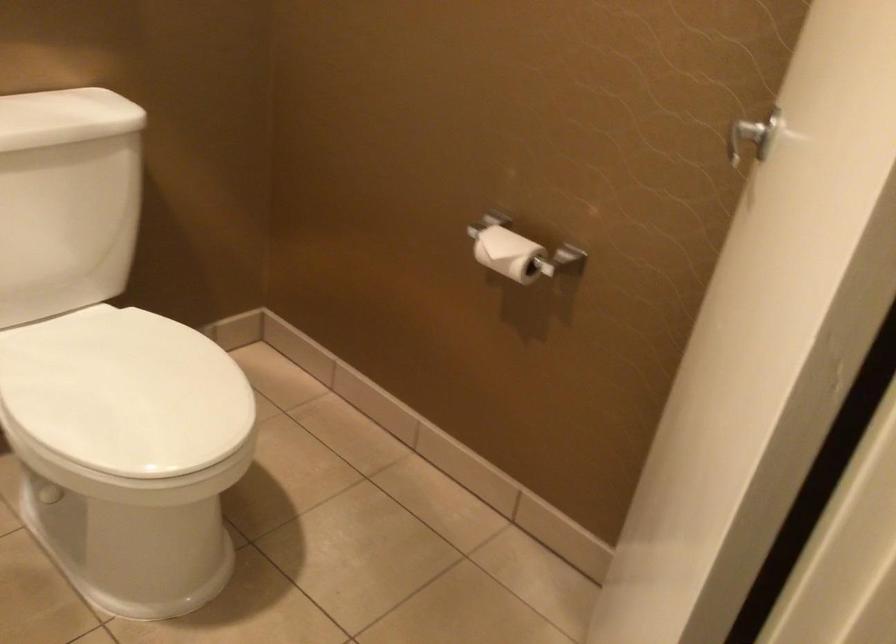
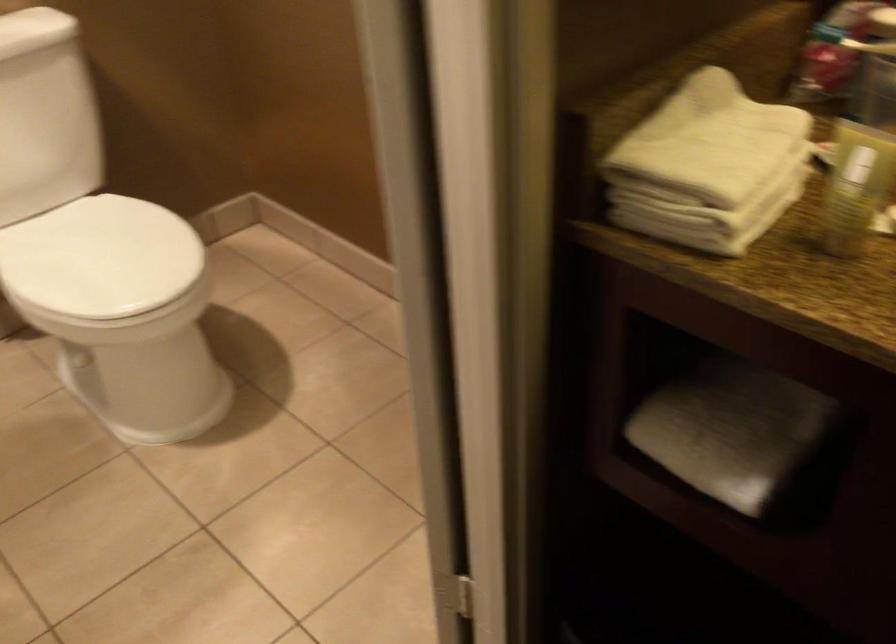
Question: The camera is either moving clockwise (left) or counter-clockwise (right) around the object. The first image is from the beginning of the video and the second image is from the end. Is the camera moving left or right when shooting the video?

Choices:
 (A) Left
 (B) Right

Answer: (B)